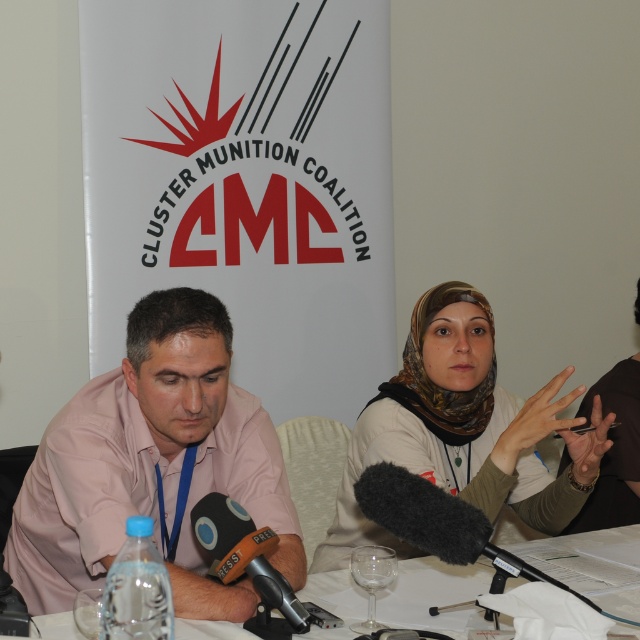
Is pink shirt at left smaller than brown fabric handbag at upper right?

No, pink shirt at left is not smaller than brown fabric handbag at upper right.

Can you confirm if pink shirt at left is thinner than brown fabric handbag at upper right?

In fact, pink shirt at left might be wider than brown fabric handbag at upper right.

Who is more distant from viewer, (186,404) or (609,472)?

The point (609,472) is more distant.

I want to click on pink shirt at left, so click(152, 465).

Who is positioned more to the left, pink shirt at left or brown printed scarf at center?

pink shirt at left is more to the left.

Who is positioned more to the right, pink shirt at left or brown printed scarf at center?

From the viewer's perspective, brown printed scarf at center appears more on the right side.

Between point (186, 316) and point (403, 364), which one is positioned in front?

Point (186, 316) is in front.

Where is `pink shirt at left`? This screenshot has width=640, height=640. pink shirt at left is located at coordinates [152, 465].

Between point (35, 524) and point (426, 573), which one is positioned behind?

The point (426, 573) is behind.

Which is above, pink shirt at left or white paper at center?

pink shirt at left is above.

Describe the element at coordinates (152, 465) in the screenshot. I see `pink shirt at left` at that location.

I want to click on pink shirt at left, so click(x=152, y=465).